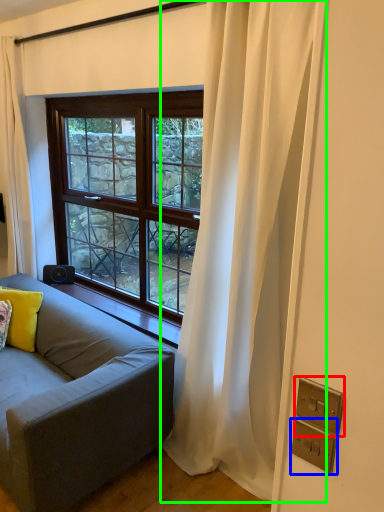
Question: Which is nearer to the electric outlet (highlighted by a red box)? electric outlet (highlighted by a blue box) or curtain (highlighted by a green box).

Choices:
 (A) electric outlet
 (B) curtain

Answer: (A)